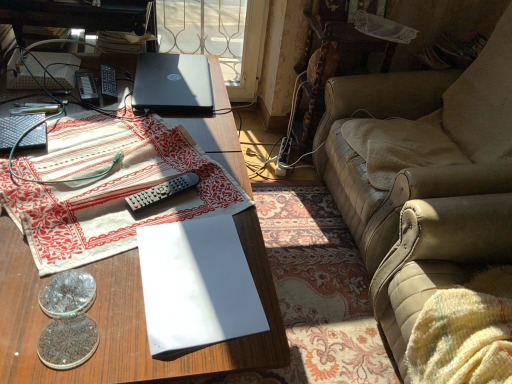
Where is `free area in between black plastic remote control at center, which ranks as the 2th remote control in left-to-right order, and white paper at center, marked as the first paperback book in a front-to-back arrangement`? The width and height of the screenshot is (512, 384). free area in between black plastic remote control at center, which ranks as the 2th remote control in left-to-right order, and white paper at center, marked as the first paperback book in a front-to-back arrangement is located at coordinates (143, 160).